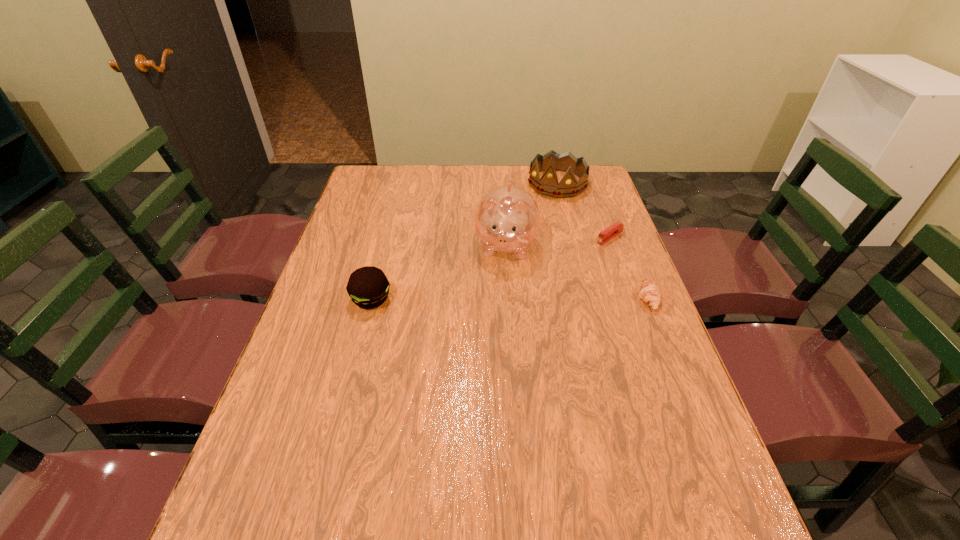
Where is `the second closest object to the pastry`? The height and width of the screenshot is (540, 960). the second closest object to the pastry is located at coordinates (507, 219).

Identify the location of vacant space that satisfies the following two spatial constraints: 1. on the back side of the stapler; 2. on the left side of the tallest object. Image resolution: width=960 pixels, height=540 pixels. (505, 237).

Where is `free space that satisfies the following two spatial constraints: 1. on the back side of the pastry; 2. on the front-facing side of the leftmost object`? This screenshot has height=540, width=960. free space that satisfies the following two spatial constraints: 1. on the back side of the pastry; 2. on the front-facing side of the leftmost object is located at coordinates (372, 299).

Image resolution: width=960 pixels, height=540 pixels. In order to click on free space that satisfies the following two spatial constraints: 1. on the front side of the piggy bank; 2. on the front-facing side of the pastry in this screenshot , I will do `click(510, 299)`.

Locate an element on the screen. Image resolution: width=960 pixels, height=540 pixels. vacant space that satisfies the following two spatial constraints: 1. on the back side of the patty; 2. on the left side of the tiara is located at coordinates (401, 184).

Locate an element on the screen. The width and height of the screenshot is (960, 540). free space that satisfies the following two spatial constraints: 1. on the front side of the stapler; 2. on the left side of the farthest object is located at coordinates (571, 237).